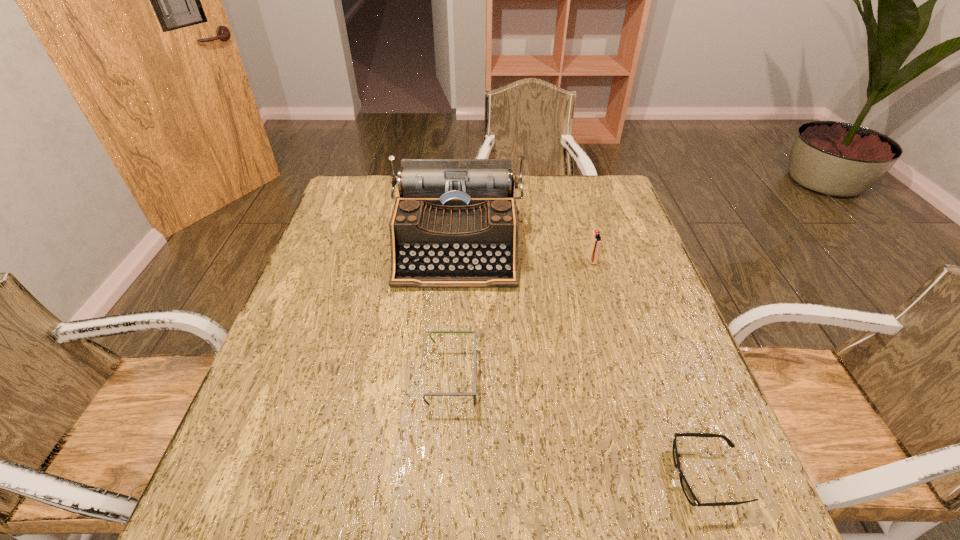
The width and height of the screenshot is (960, 540). What are the coordinates of `the tallest object` in the screenshot? It's located at point(455,225).

This screenshot has height=540, width=960. I want to click on igniter, so click(596, 240).

Where is `the third object from left to right`? This screenshot has width=960, height=540. the third object from left to right is located at coordinates point(596,240).

At what (x,y) coordinates should I click in order to perform the action: click on the second nearest object. Please return your answer as a coordinate pair (x, y). The width and height of the screenshot is (960, 540). Looking at the image, I should click on click(473, 394).

Identify the location of spectacles. The width and height of the screenshot is (960, 540). (473, 394).

Locate an element on the screen. This screenshot has height=540, width=960. sunglasses is located at coordinates 686,488.

Identify the location of the nearest object. Image resolution: width=960 pixels, height=540 pixels. (686, 488).

Identify the location of blank area located 0.150m on the keyboard of the tallest object. The height and width of the screenshot is (540, 960). (451, 336).

The height and width of the screenshot is (540, 960). What are the coordinates of `free region located on the right of the third shortest object` in the screenshot? It's located at (622, 261).

I want to click on free region located 0.400m on the lens of the third tallest object, so click(665, 376).